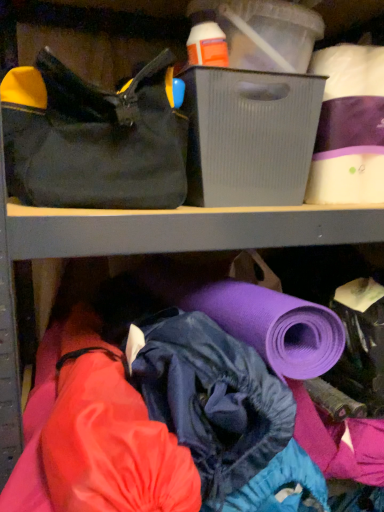
Question: From the image's perspective, is gray ribbed plastic storage box at upper center located above white matte toilet paper at upper right?

Choices:
 (A) yes
 (B) no

Answer: (B)

Question: Can you confirm if gray ribbed plastic storage box at upper center is bigger than white matte toilet paper at upper right?

Choices:
 (A) yes
 (B) no

Answer: (A)

Question: Is gray ribbed plastic storage box at upper center completely or partially outside of white matte toilet paper at upper right?

Choices:
 (A) no
 (B) yes

Answer: (B)

Question: Is gray ribbed plastic storage box at upper center thinner than white matte toilet paper at upper right?

Choices:
 (A) yes
 (B) no

Answer: (B)

Question: Is gray ribbed plastic storage box at upper center not near white matte toilet paper at upper right?

Choices:
 (A) no
 (B) yes

Answer: (A)

Question: Looking at their shapes, would you say white matte toilet paper at upper right is wider or thinner than gray ribbed plastic storage box at upper center?

Choices:
 (A) wide
 (B) thin

Answer: (B)

Question: From their relative heights in the image, would you say white matte toilet paper at upper right is taller or shorter than gray ribbed plastic storage box at upper center?

Choices:
 (A) short
 (B) tall

Answer: (B)

Question: Relative to gray ribbed plastic storage box at upper center, is white matte toilet paper at upper right in front or behind?

Choices:
 (A) front
 (B) behind

Answer: (B)

Question: Is point (352, 75) closer or farther from the camera than point (278, 96)?

Choices:
 (A) farther
 (B) closer

Answer: (A)

Question: Is point (372, 112) closer or farther from the camera than point (162, 157)?

Choices:
 (A) farther
 (B) closer

Answer: (A)

Question: Considering the relative positions of white matte toilet paper at upper right and black canvas handbag at upper left in the image provided, is white matte toilet paper at upper right to the left or to the right of black canvas handbag at upper left?

Choices:
 (A) left
 (B) right

Answer: (B)

Question: From the image's perspective, is white matte toilet paper at upper right positioned above or below black canvas handbag at upper left?

Choices:
 (A) below
 (B) above

Answer: (B)

Question: Relative to black canvas handbag at upper left, is white matte toilet paper at upper right in front or behind?

Choices:
 (A) front
 (B) behind

Answer: (B)

Question: Is gray ribbed plastic storage box at upper center taller or shorter than black canvas handbag at upper left?

Choices:
 (A) short
 (B) tall

Answer: (A)

Question: Is gray ribbed plastic storage box at upper center in front of or behind black canvas handbag at upper left in the image?

Choices:
 (A) front
 (B) behind

Answer: (B)